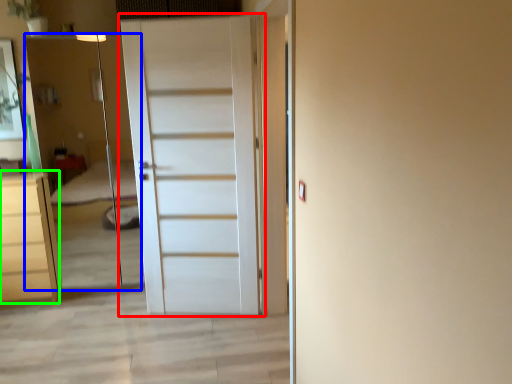
Question: Which object is positioned closest to door (highlighted by a red box)? Select from elevator (highlighted by a blue box) and chest of drawers (highlighted by a green box).

Choices:
 (A) elevator
 (B) chest of drawers

Answer: (B)